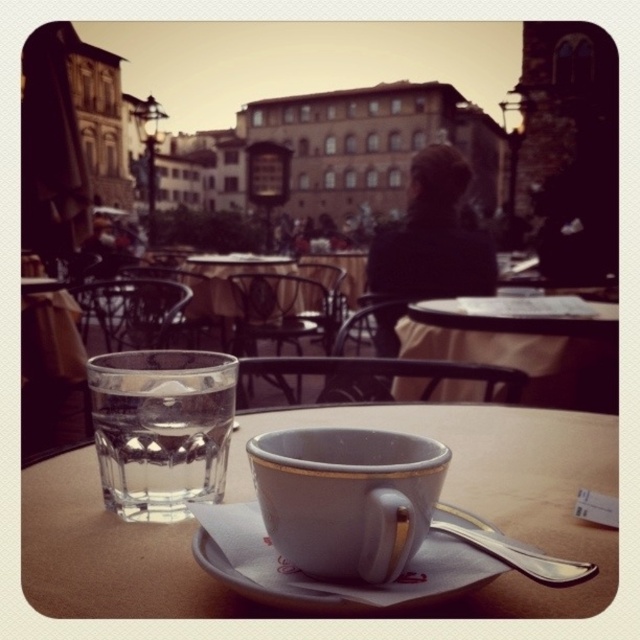
Is matte ceramic cup at center shorter than white ceramic table at center?

Yes.

This screenshot has height=640, width=640. In order to click on matte ceramic cup at center in this screenshot , I will do `click(346, 497)`.

Can you confirm if clear glass at left is positioned below white ceramic saucer at center?

Incorrect, clear glass at left is not positioned below white ceramic saucer at center.

Is clear glass at left closer to the viewer compared to white ceramic saucer at center?

No, it is behind white ceramic saucer at center.

Which is in front, point (179, 426) or point (467, 544)?

Point (467, 544) is in front.

The width and height of the screenshot is (640, 640). In order to click on clear glass at left in this screenshot , I will do `click(161, 428)`.

Consider the image. Does white ceramic saucer at center have a lesser height compared to white ceramic table at center?

Correct, white ceramic saucer at center is not as tall as white ceramic table at center.

Can you confirm if white ceramic saucer at center is positioned below white ceramic table at center?

Correct, white ceramic saucer at center is located below white ceramic table at center.

Where is `white ceramic saucer at center`? Image resolution: width=640 pixels, height=640 pixels. white ceramic saucer at center is located at coordinates (326, 580).